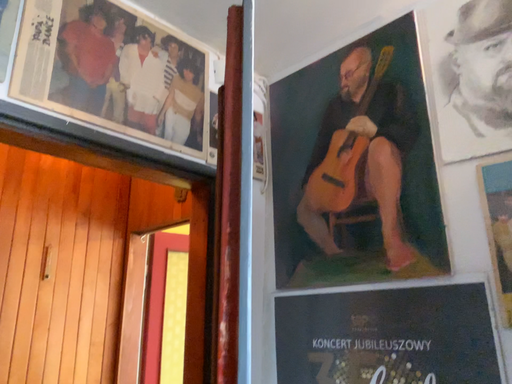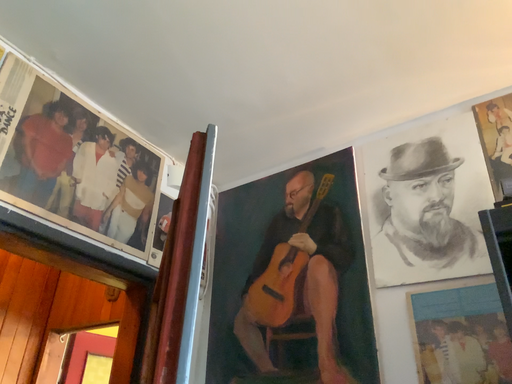
Question: Which way did the camera rotate in the video?

Choices:
 (A) rotated left
 (B) rotated right

Answer: (B)